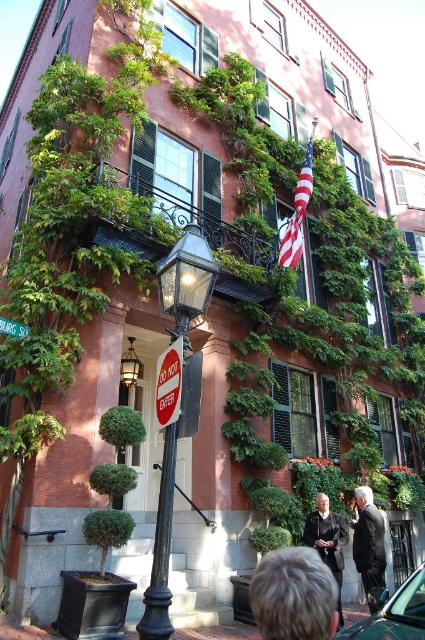
Based on the photo, between green matte car at lower right and dark suit at lower right, which one has more height?

dark suit at lower right is taller.

Is green matte car at lower right closer to the viewer compared to dark suit at lower right?

That is True.

Is point (350, 628) closer to camera compared to point (367, 536)?

Yes, point (350, 628) is closer to viewer.

This screenshot has height=640, width=425. What are the coordinates of `green matte car at lower right` in the screenshot? It's located at (393, 612).

Between point (374, 621) and point (285, 236), which one is positioned in front?

Positioned in front is point (374, 621).

Does point (422, 566) come in front of point (308, 154)?

Yes, it is in front of point (308, 154).

Where is `green matte car at lower right`? This screenshot has height=640, width=425. green matte car at lower right is located at coordinates (393, 612).

Measure the distance between blonde hair at lower center and american flag at center.

The distance of blonde hair at lower center from american flag at center is 11.73 meters.

Does blonde hair at lower center lie in front of american flag at center?

Yes.

Locate an element on the screen. This screenshot has width=425, height=640. blonde hair at lower center is located at coordinates (294, 595).